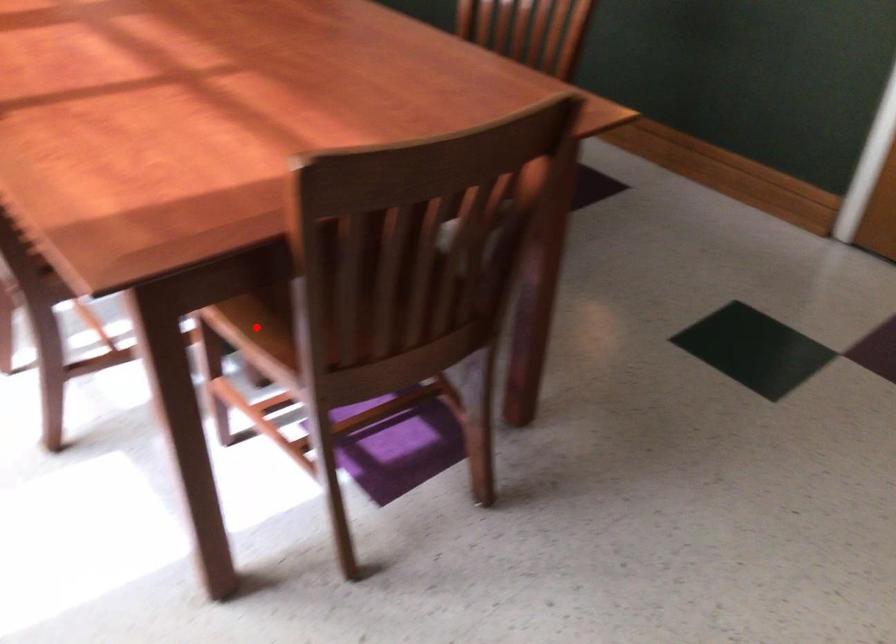
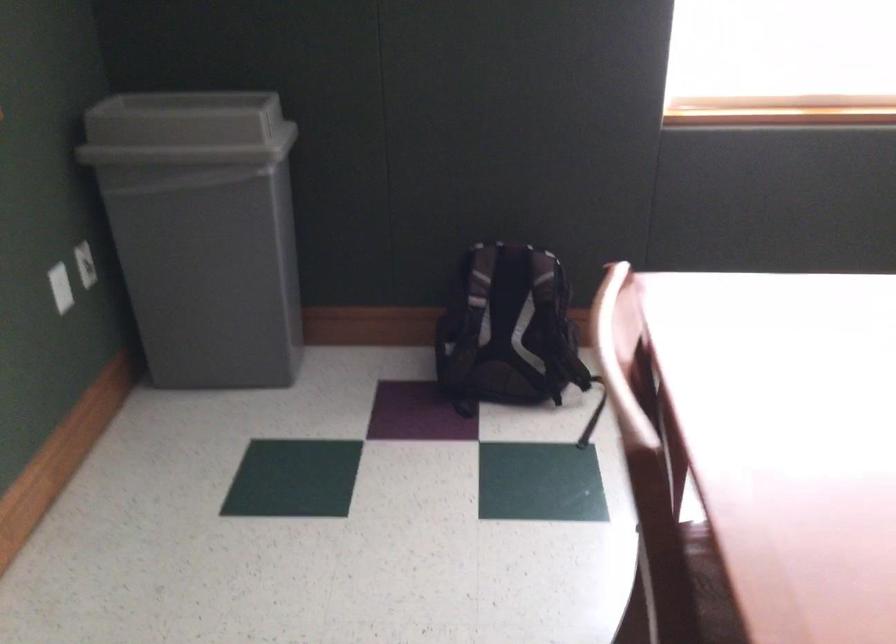
Question: I am providing you with two images of the same scene from different viewpoints. A red point is marked on the first image. Is the red point's position out of view in image 2?

Choices:
 (A) Yes
 (B) No

Answer: (A)